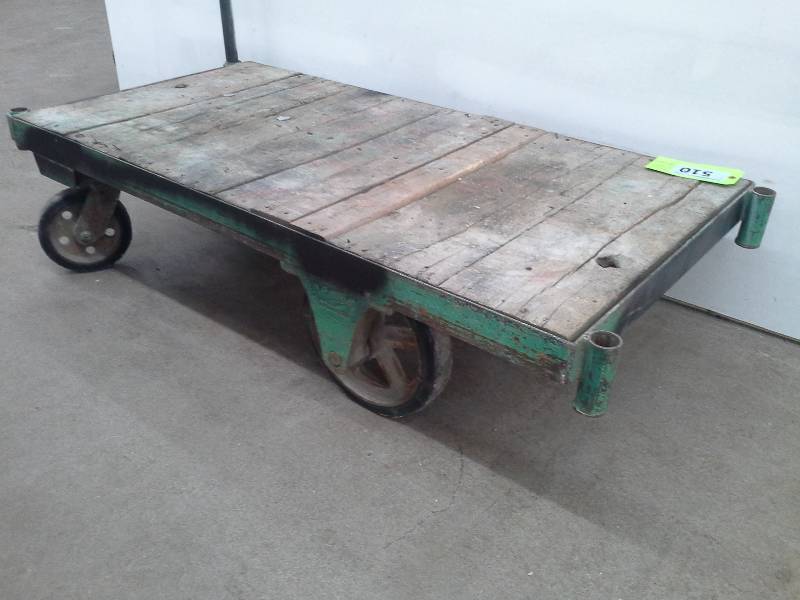
The width and height of the screenshot is (800, 600). What are the coordinates of `concrete floor` in the screenshot? It's located at (334, 497), (706, 479), (46, 415), (22, 185), (48, 82).